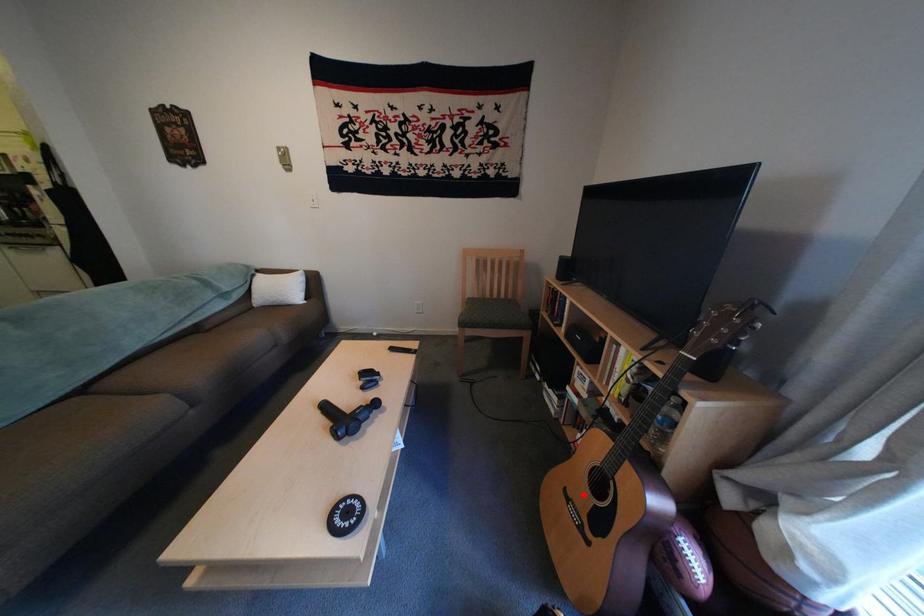
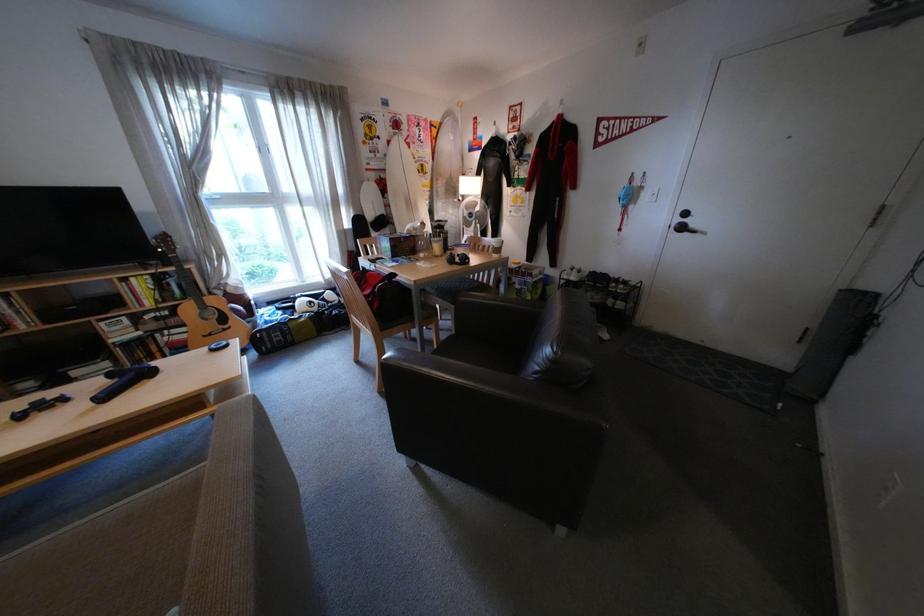
Question: I am providing you with two images of the same scene from different viewpoints. Image1 has a red point marked. In image2, the corresponding 3D location appears at what relative position? Reply with the corresponding letter.

Choices:
 (A) Closer
 (B) Farther

Answer: (B)